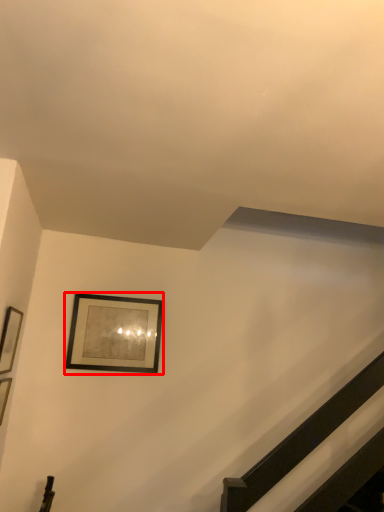
Question: From the image's perspective, where is picture frame (annotated by the red box) located relative to picture frame?

Choices:
 (A) below
 (B) above

Answer: (A)